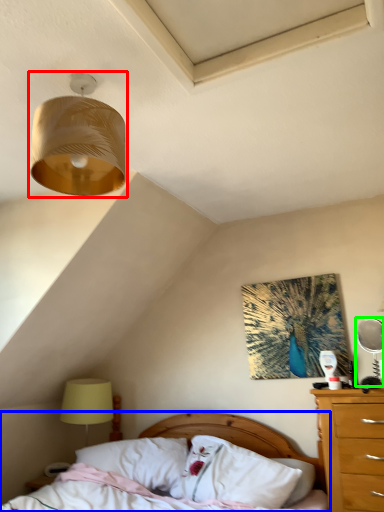
Question: Considering the real-world distances, which object is closest to lamp (highlighted by a red box)? bed (highlighted by a blue box) or mechanical fan (highlighted by a green box).

Choices:
 (A) bed
 (B) mechanical fan

Answer: (B)